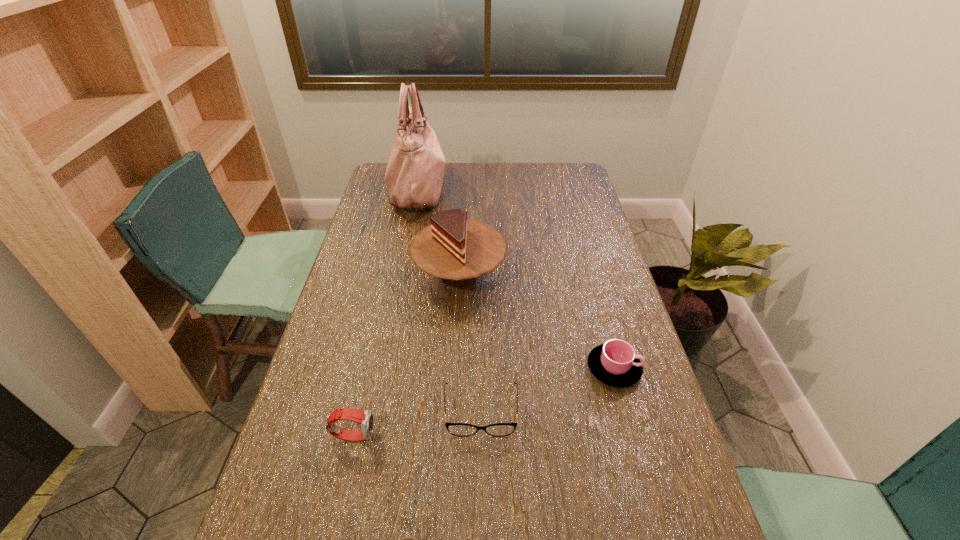
Choose which object is the second nearest neighbor to the third shortest object. Please provide its 2D coordinates. Your answer should be formatted as a tuple, i.e. [(x, y)], where the tuple contains the x and y coordinates of a point satisfying the conditions above.

[(458, 251)]

You are a GUI agent. You are given a task and a screenshot of the screen. Output one action in this format:
    pyautogui.click(x=<x>, y=<y>)
    Task: Click on the vacant space that satisfies the following two spatial constraints: 1. at the front of the second farthest object with handles; 2. on the left side of the handbag
    The image size is (960, 540).
    Given the screenshot: What is the action you would take?
    pyautogui.click(x=399, y=275)